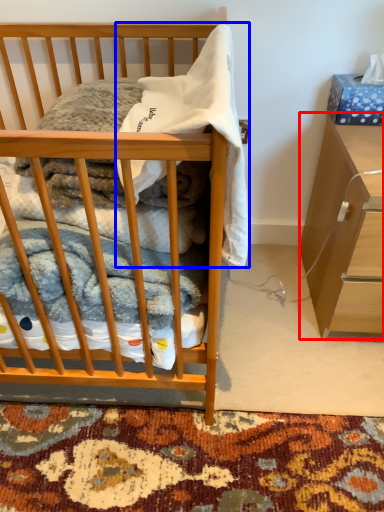
Question: Which of the following is the closest to the observer, cabinetry (highlighted by a red box) or baby clothe (highlighted by a blue box)?

Choices:
 (A) cabinetry
 (B) baby clothe

Answer: (B)